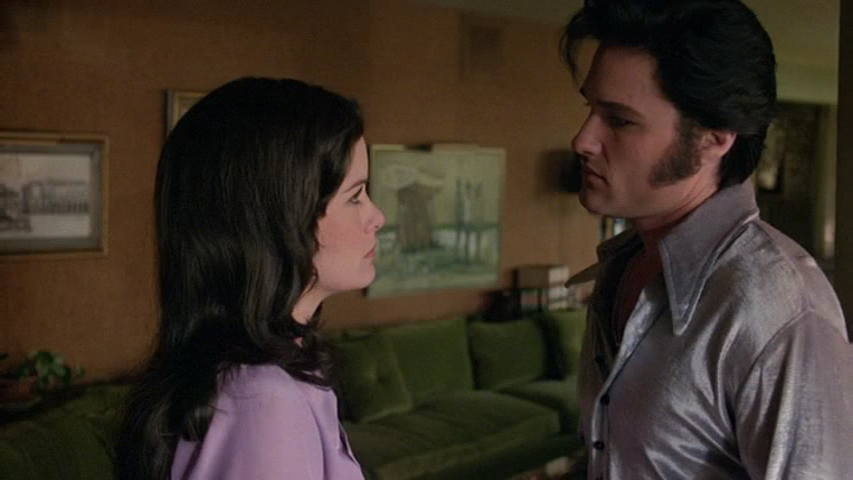
Where is `sofa`? The image size is (853, 480). sofa is located at coordinates click(461, 419).